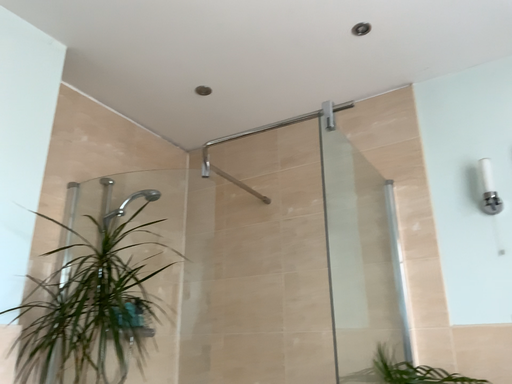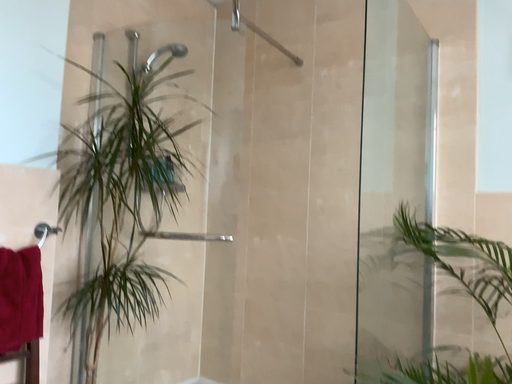
Question: Which way did the camera rotate in the video?

Choices:
 (A) rotated upward
 (B) rotated downward

Answer: (B)